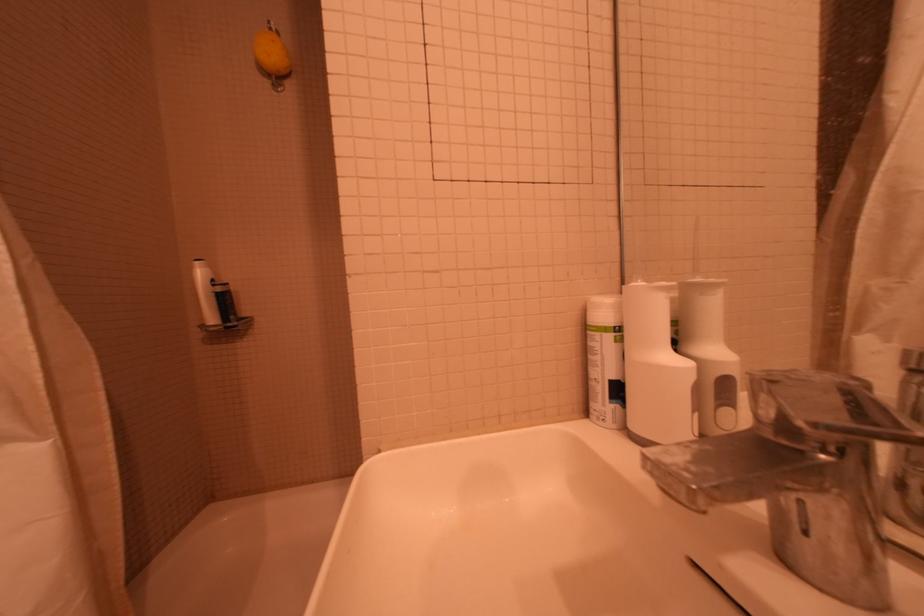
Where would you lift the metal faucet handle? Please return your answer as a coordinate pair (x, y).

(800, 476)